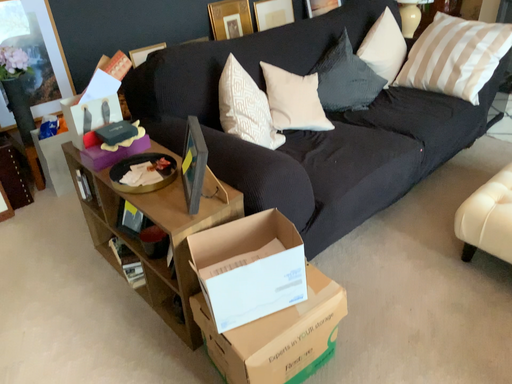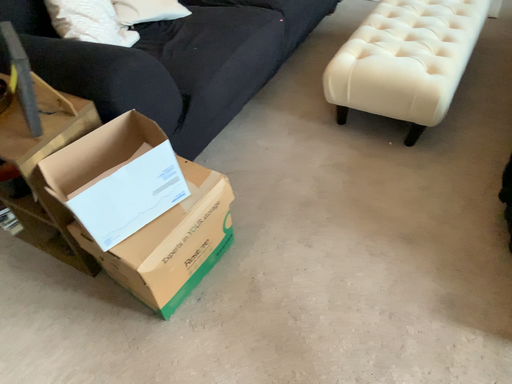
Question: Which way did the camera rotate in the video?

Choices:
 (A) rotated left
 (B) rotated right

Answer: (B)